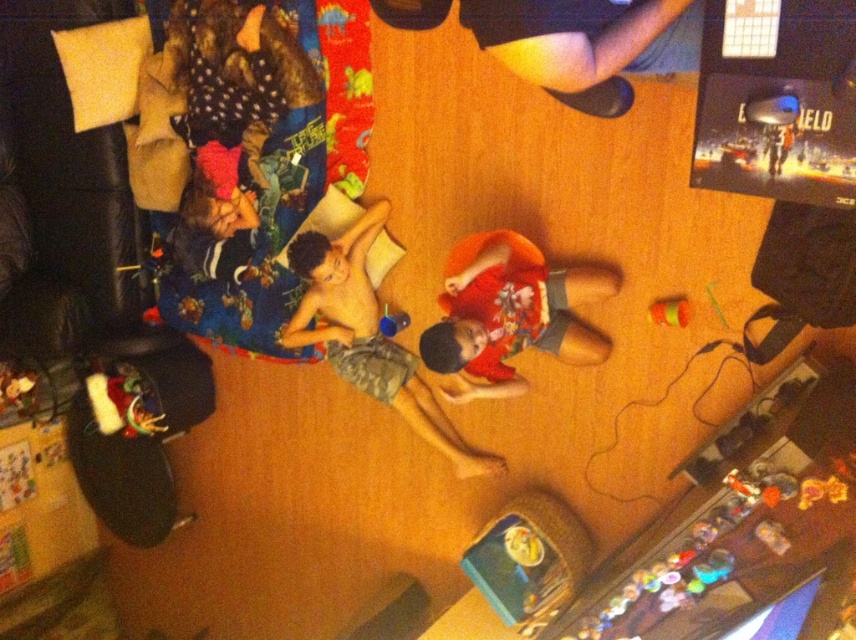
You are standing at the entrance of the room and want to pick up the orange cotton shirt at center without moving the black leather shoes at upper right. Is this possible?

The black leather shoes at upper right is in front of the orange cotton shirt at center, so you can reach the orange cotton shirt at center by moving around the black leather shoes at upper right.

You are standing at the point marked by the coordinates point (x=587, y=44), which is located at the upper right of the image. You want to move to the area where the two people are lying on the floor. Which direction should you go to reach them?

The two people are lying in the center of the image, so from the point (x=587, y=44) at the upper right, you should move downward and to the left to reach them.

You are trying to pick up the orange cotton shirt at center and the camouflage shorts at center from the floor. How far apart are these two items?

The orange cotton shirt at center is 22.01 inches away from the camouflage shorts at center.